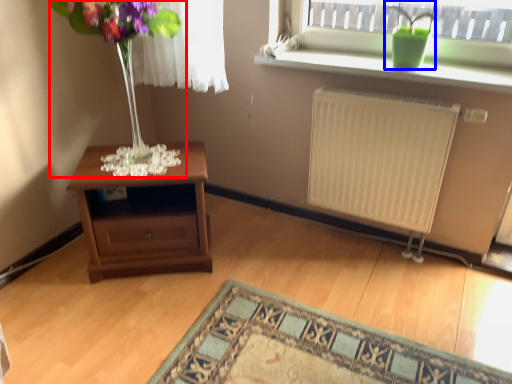
Question: Which object is closer to the camera taking this photo, bouquet (highlighted by a red box) or houseplant (highlighted by a blue box)?

Choices:
 (A) bouquet
 (B) houseplant

Answer: (A)